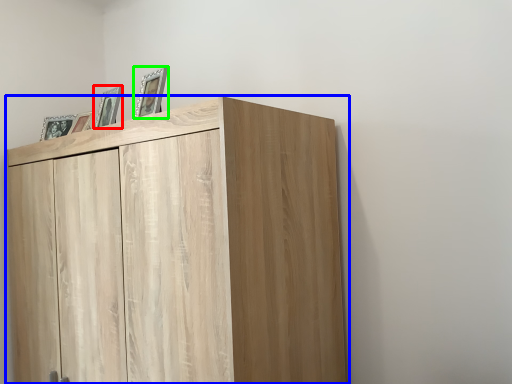
Question: Estimate the real-world distances between objects in this image. Which object is closer to picture frame (highlighted by a red box), cupboard (highlighted by a blue box) or picture frame (highlighted by a green box)?

Choices:
 (A) cupboard
 (B) picture frame

Answer: (B)